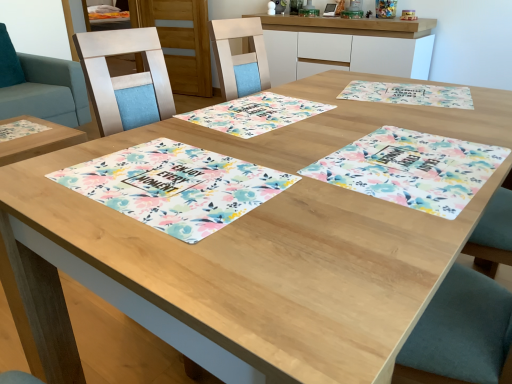
Question: Can floral fabric placemat at center, which is the second place mat from right to left, be found inside white glossy cabinet at upper center, marked as the first cabinetry in a right-to-left arrangement?

Choices:
 (A) yes
 (B) no

Answer: (B)

Question: Considering the relative positions of white glossy cabinet at upper center, the 1th cabinetry viewed from the front, and floral fabric placemat at center, positioned as the third place mat in left-to-right order, in the image provided, is white glossy cabinet at upper center, the 1th cabinetry viewed from the front, to the left of floral fabric placemat at center, positioned as the third place mat in left-to-right order, from the viewer's perspective?

Choices:
 (A) no
 (B) yes

Answer: (A)

Question: From a real-world perspective, is white glossy cabinet at upper center, which is counted as the second cabinetry, starting from the left, over floral fabric placemat at center, positioned as the third place mat in left-to-right order?

Choices:
 (A) yes
 (B) no

Answer: (B)

Question: Is white glossy cabinet at upper center, marked as the first cabinetry in a right-to-left arrangement, placed right next to floral fabric placemat at center, which is the second place mat from right to left?

Choices:
 (A) yes
 (B) no

Answer: (B)

Question: Is white glossy cabinet at upper center, which appears as the 2th cabinetry when viewed from the back, to the right of floral fabric placemat at center, which is the second place mat from right to left, from the viewer's perspective?

Choices:
 (A) no
 (B) yes

Answer: (B)

Question: Is white glossy cabinet at upper center, the 1th cabinetry viewed from the front, outside floral fabric placemat at center, positioned as the third place mat in left-to-right order?

Choices:
 (A) yes
 (B) no

Answer: (A)

Question: Is floral fabric placemat at center, which is counted as the 4th place mat, starting from the right, at the right side of teal fabric swivel chair at upper left?

Choices:
 (A) yes
 (B) no

Answer: (A)

Question: From a real-world perspective, is floral fabric placemat at center, which is counted as the 4th place mat, starting from the right, on teal fabric swivel chair at upper left?

Choices:
 (A) yes
 (B) no

Answer: (A)

Question: Considering the relative positions of floral fabric placemat at center, the 1th place mat when ordered from left to right, and teal fabric swivel chair at upper left in the image provided, is floral fabric placemat at center, the 1th place mat when ordered from left to right, behind teal fabric swivel chair at upper left?

Choices:
 (A) yes
 (B) no

Answer: (B)

Question: Does floral fabric placemat at center, which is counted as the 4th place mat, starting from the right, have a smaller size compared to teal fabric swivel chair at upper left?

Choices:
 (A) yes
 (B) no

Answer: (A)

Question: Is floral fabric placemat at center, which is counted as the 4th place mat, starting from the right, bigger than teal fabric swivel chair at upper left?

Choices:
 (A) no
 (B) yes

Answer: (A)

Question: Is teal fabric swivel chair at upper left touching white glossy cabinet at upper center, marked as the first cabinetry in a right-to-left arrangement?

Choices:
 (A) no
 (B) yes

Answer: (A)